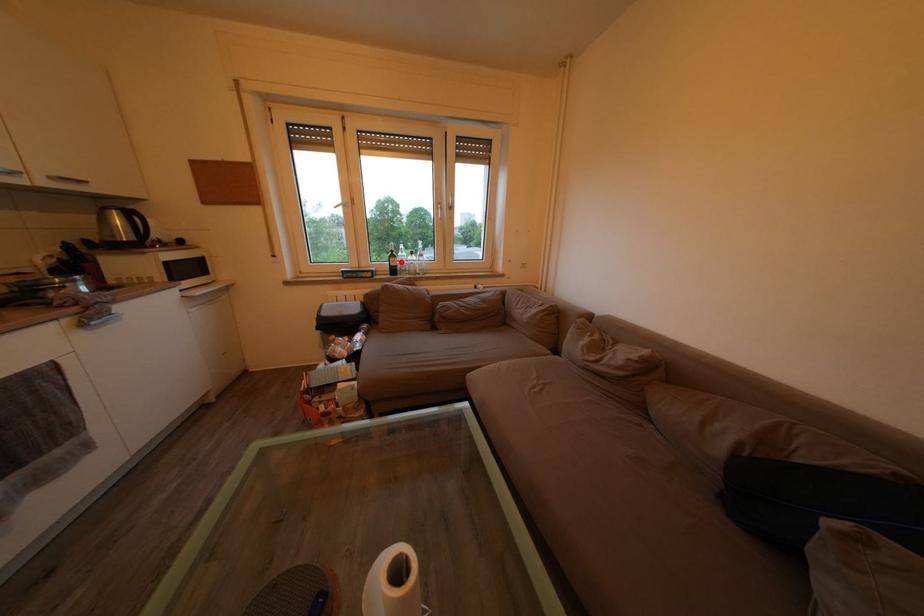
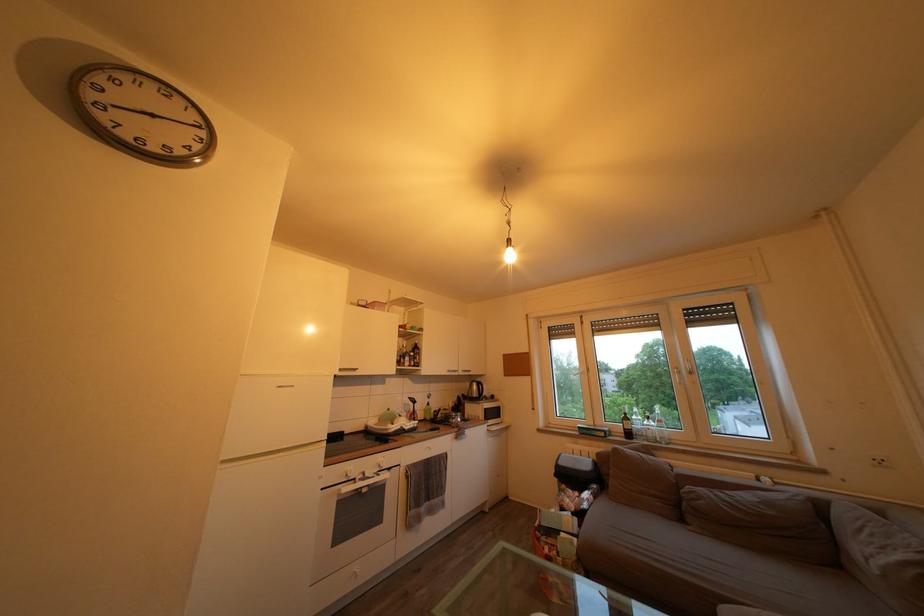
Question: I am providing you with two images of the same scene from different viewpoints. Given a red point in image1, look at the same physical point in image2. Is it:

Choices:
 (A) Closer to the viewpoint
 (B) Farther from the viewpoint

Answer: (B)